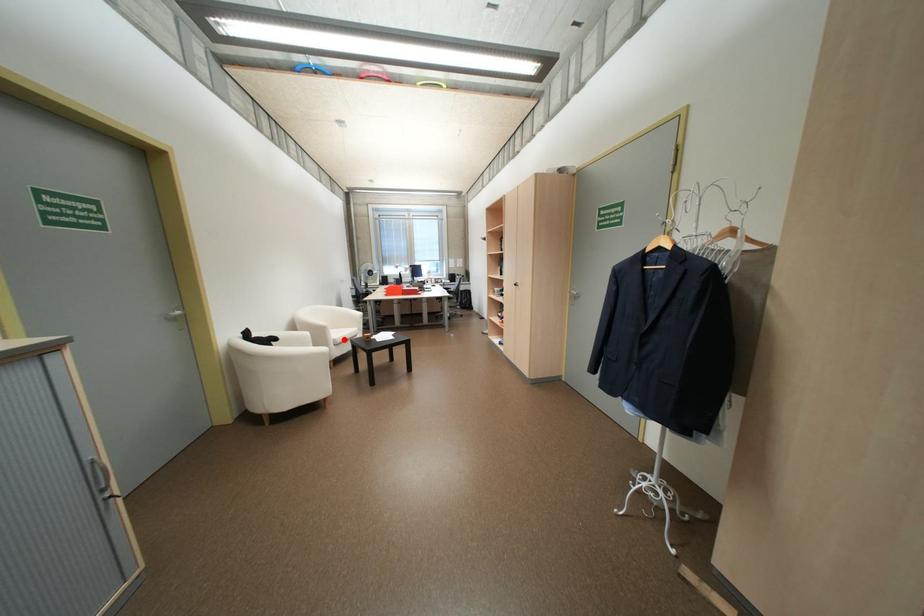
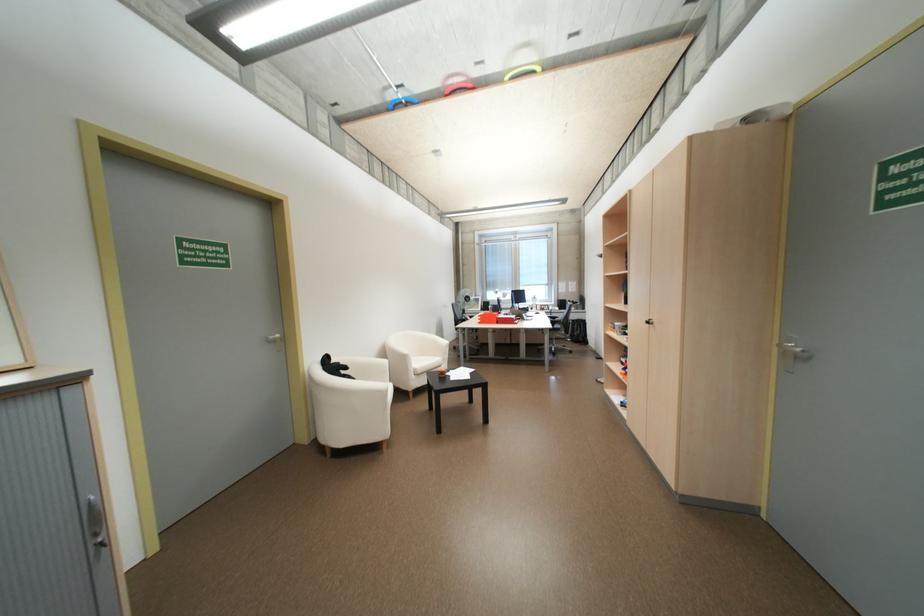
Question: I am providing you with two images of the same scene from different viewpoints. A red point is shown in image1. For the corresponding object point in image2, is it positioned nearer or farther from the camera?

Choices:
 (A) Nearer
 (B) Farther

Answer: (B)